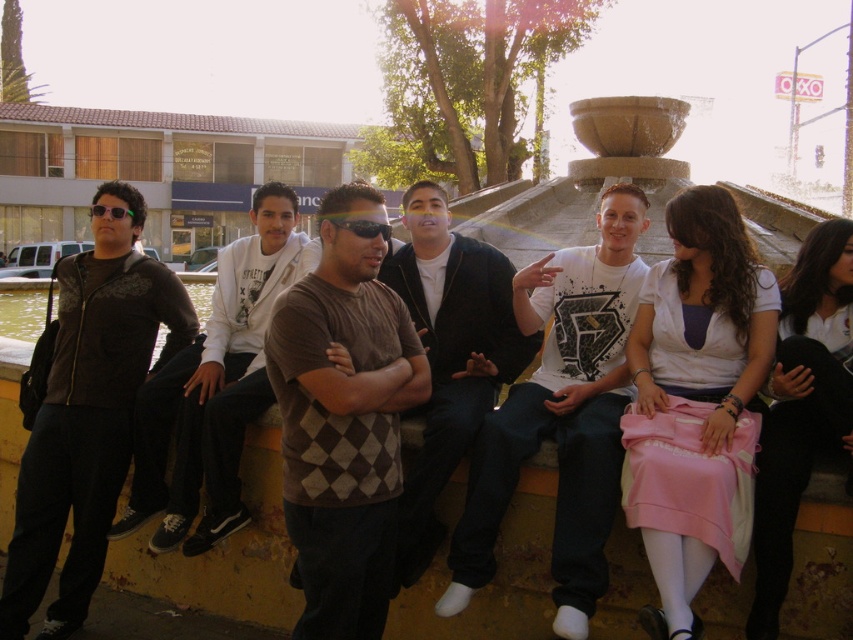
Is dark gray argyle sweater at center positioned in front of argyle sweater at center?

No, dark gray argyle sweater at center is behind argyle sweater at center.

In the scene shown: Does dark gray argyle sweater at center have a lesser height compared to argyle sweater at center?

Indeed, dark gray argyle sweater at center has a lesser height compared to argyle sweater at center.

Find the location of a particular element. Image resolution: width=853 pixels, height=640 pixels. dark gray argyle sweater at center is located at coordinates (213, 388).

Where is `dark gray argyle sweater at center`? The width and height of the screenshot is (853, 640). dark gray argyle sweater at center is located at coordinates (213, 388).

Is white matte t-shirt at center below dark gray argyle sweater at center?

Correct, white matte t-shirt at center is located below dark gray argyle sweater at center.

Does white matte t-shirt at center have a larger size compared to dark gray argyle sweater at center?

Yes, white matte t-shirt at center is bigger than dark gray argyle sweater at center.

Between point (613, 476) and point (129, 508), which one is positioned behind?

The point (129, 508) is behind.

Find the location of a particular element. The height and width of the screenshot is (640, 853). white matte t-shirt at center is located at coordinates (561, 413).

Who is more forward, (579, 538) or (354, 230)?

Point (579, 538) is more forward.

Which of these two, white matte t-shirt at center or matte black sunglasses at center, stands taller?

Standing taller between the two is white matte t-shirt at center.

This screenshot has height=640, width=853. I want to click on white matte t-shirt at center, so click(x=561, y=413).